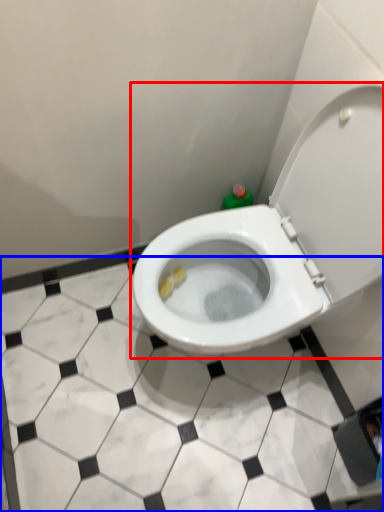
Question: Which object is closer to the camera taking this photo, toilet (highlighted by a red box) or tile (highlighted by a blue box)?

Choices:
 (A) toilet
 (B) tile

Answer: (A)